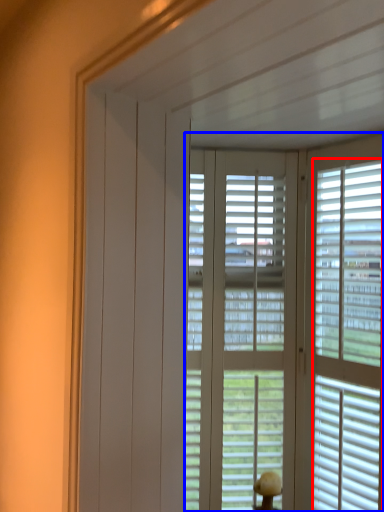
Question: Which of the following is the closest to the observer, blind (highlighted by a red box) or window blind (highlighted by a blue box)?

Choices:
 (A) blind
 (B) window blind

Answer: (A)